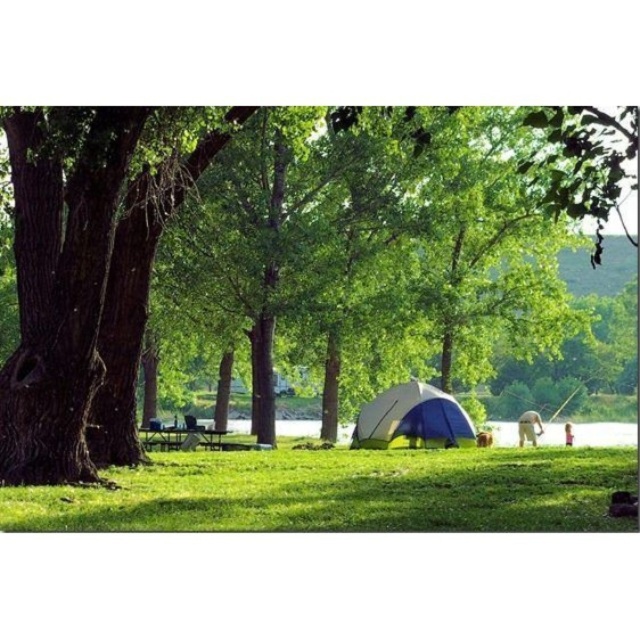
You are planning to set up a picnic blanket in this camping area. The picnic blanket is 10 feet long. Considering the distance between the green leafy tree at center and the green grass at lower center, will the blanket fit horizontally between them without overlapping either?

The distance between the green leafy tree at center and the green grass at lower center is 11.65 feet. Since the picnic blanket is 10 feet long, it will fit horizontally between them without overlapping either.

In the scene shown: You are planning to set up a tent in this camping scene. You see the green leafy tree at center and the green grass at lower center. Which location is better for setting up the tent to avoid the tree? Explain your reasoning based on their positions.

The green grass at lower center is to the right of the green leafy tree at center. Setting up the tent on the green grass at lower center would place it away from the tree, avoiding potential obstacles like roots or falling branches.